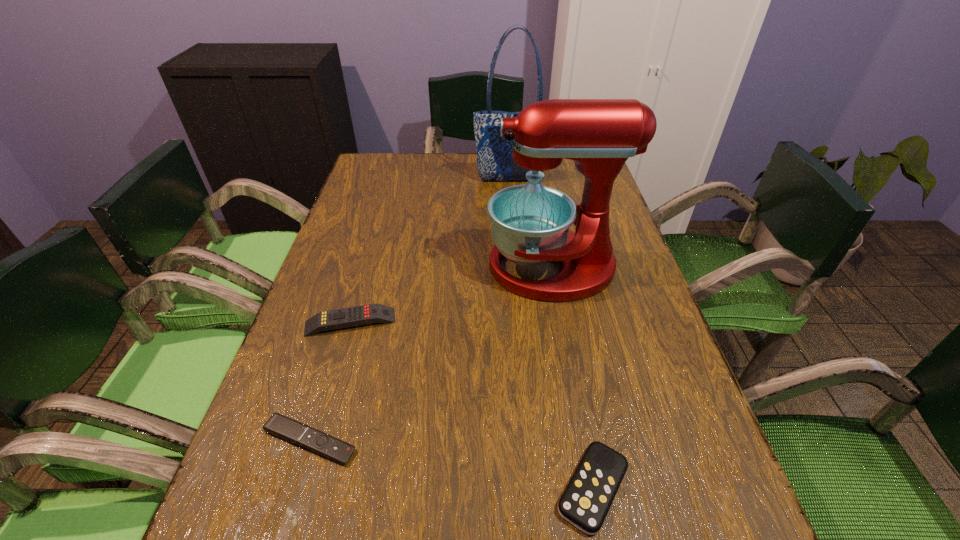
This screenshot has height=540, width=960. Find the location of `vacant space located on the front of the farthest remote control`. vacant space located on the front of the farthest remote control is located at coordinates (307, 470).

Locate an element on the screen. The image size is (960, 540). free region located on the right of the fourth tallest object is located at coordinates (676, 488).

Identify the location of vacant area located 0.100m on the back of the shortest object. (331, 370).

Where is `object present at the far edge`? The width and height of the screenshot is (960, 540). object present at the far edge is located at coordinates (495, 162).

Where is `mixer that is at the right edge`? mixer that is at the right edge is located at coordinates (530, 223).

At what (x,y) coordinates should I click in order to perform the action: click on remote control present at the right edge. Please return your answer as a coordinate pair (x, y). This screenshot has height=540, width=960. Looking at the image, I should click on (585, 503).

Locate an element on the screen. The width and height of the screenshot is (960, 540). free space at the far edge of the desktop is located at coordinates (477, 175).

In the image, there is a desktop. In order to click on vacant space at the left edge in this screenshot , I will do click(x=368, y=205).

I want to click on vacant space at the right edge of the desktop, so click(707, 441).

In the image, there is a desktop. At what (x,y) coordinates should I click in order to perform the action: click on free space at the far left corner. Please return your answer as a coordinate pair (x, y). This screenshot has width=960, height=540. Looking at the image, I should click on (387, 189).